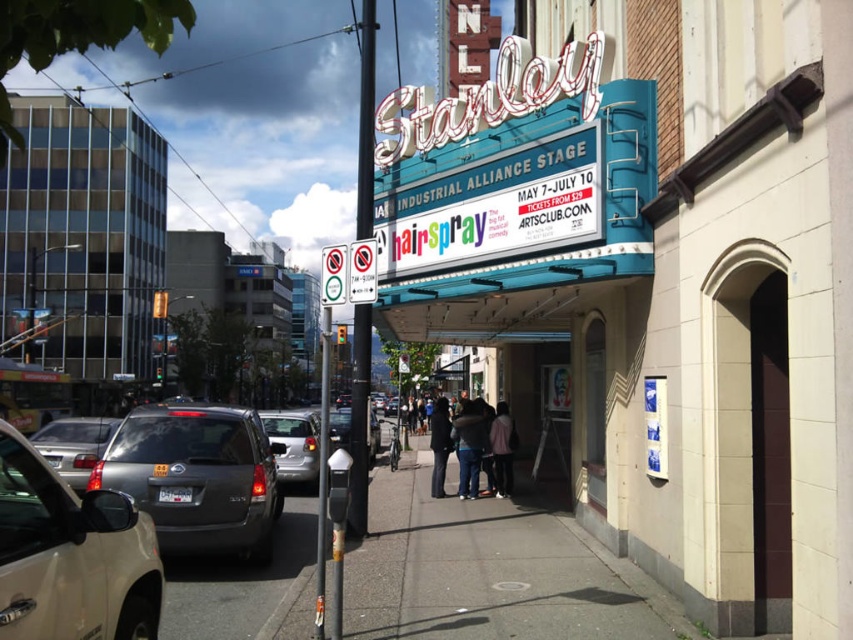
Based on the photo, is matte gray suv at left to the right of dark brown leather jacket at center from the viewer's perspective?

No, matte gray suv at left is not to the right of dark brown leather jacket at center.

Which is more to the right, matte gray suv at left or dark brown leather jacket at center?

From the viewer's perspective, dark brown leather jacket at center appears more on the right side.

What are the coordinates of `matte gray suv at left` in the screenshot? It's located at (236, 582).

Locate an element on the screen. matte gray suv at left is located at coordinates (236, 582).

Is smooth concrete sidewalk at center bigger than satin silver sedan at center?

No.

Is smooth concrete sidewalk at center positioned behind satin silver sedan at center?

That is False.

Identify the location of smooth concrete sidewalk at center. (490, 572).

Which is behind, point (302, 452) or point (508, 497)?

The point (302, 452) is behind.

The image size is (853, 640). What do you see at coordinates (294, 444) in the screenshot? I see `satin silver sedan at center` at bounding box center [294, 444].

Where is `satin silver sedan at center`? The width and height of the screenshot is (853, 640). satin silver sedan at center is located at coordinates (294, 444).

The height and width of the screenshot is (640, 853). Identify the location of satin silver sedan at center. (294, 444).